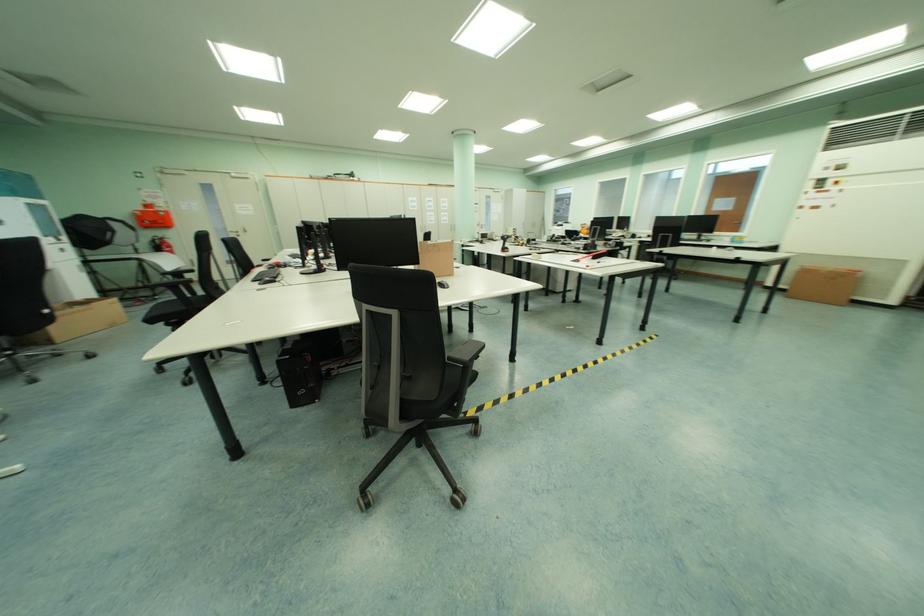
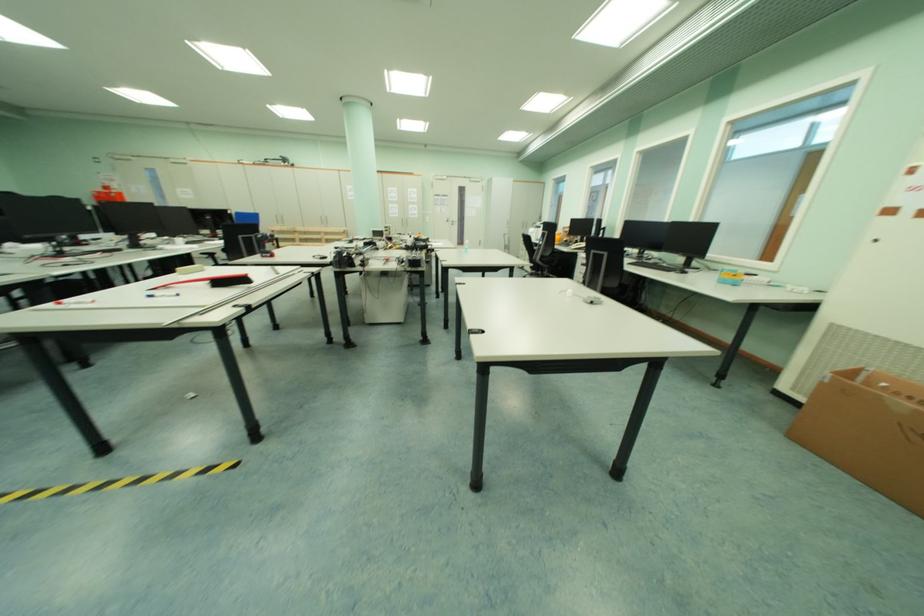
The images are taken continuously from a first-person perspective. In which direction are you moving?

The movement direction of the cameraman is right, forward.